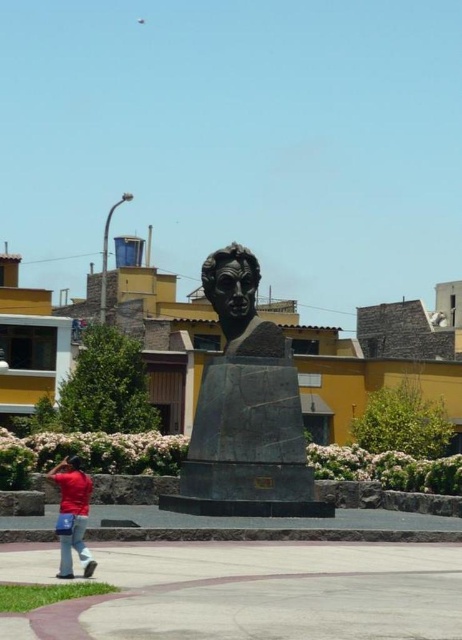
Question: Which point is farther from the camera taking this photo?

Choices:
 (A) [72, 483]
 (B) [224, 301]
 (C) [226, 282]

Answer: (B)

Question: Can you confirm if bronze bust at center is wider than matte red shirt at lower left?

Choices:
 (A) no
 (B) yes

Answer: (B)

Question: Among these points, which one is farthest from the camera?

Choices:
 (A) (237, 305)
 (B) (67, 538)

Answer: (A)

Question: Can you confirm if black polished stone bust at center is positioned to the left of matte red shirt at lower left?

Choices:
 (A) yes
 (B) no

Answer: (B)

Question: Which point is closer to the camera taking this photo?

Choices:
 (A) (214, 253)
 (B) (66, 557)
 (C) (260, 513)

Answer: (B)

Question: In this image, where is bronze bust at center located relative to matte red shirt at lower left?

Choices:
 (A) below
 (B) above

Answer: (B)